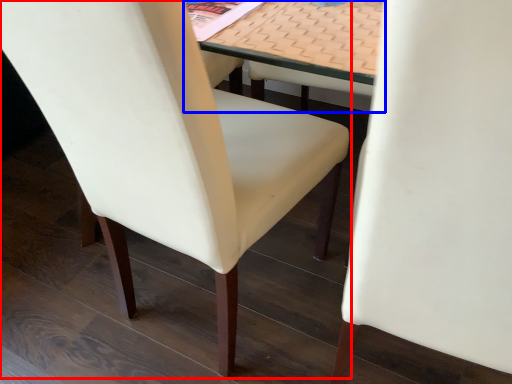
Question: Which point is further to the camera, chair (highlighted by a red box) or table (highlighted by a blue box)?

Choices:
 (A) chair
 (B) table

Answer: (B)